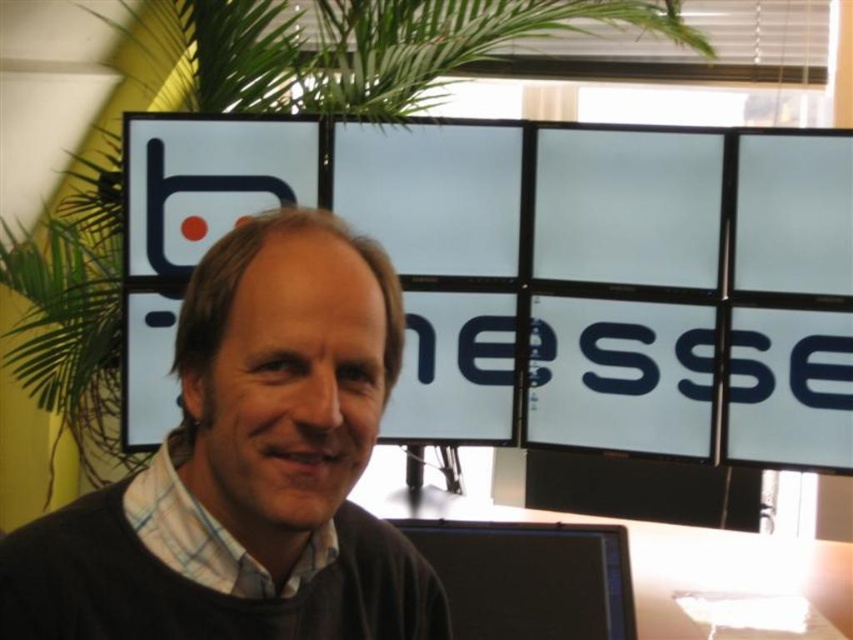
You are an office worker who needs to place a new item on the desk. The desk has limited space. You have a dark brown sweater at center and a black glossy monitor at lower center. Which item takes up more desk space?

The dark brown sweater at center is larger in size than the black glossy monitor at lower center, so it takes up more desk space.

You are an office worker who needs to reach the black glossy monitor at lower center to adjust its settings. However, there is a dark brown sweater at center in your way. Based on their positions, can you move the sweater to access the monitor?

The dark brown sweater at center is to the left of the black glossy monitor at lower center, so you can move the sweater to the right to access the monitor.

You are standing in front of the man in the image. There are two points marked in the scene at coordinates point (334, 620) and point (463, 620). Which point is closer to you?

Point (334, 620) is closer to the viewer than point (463, 620).